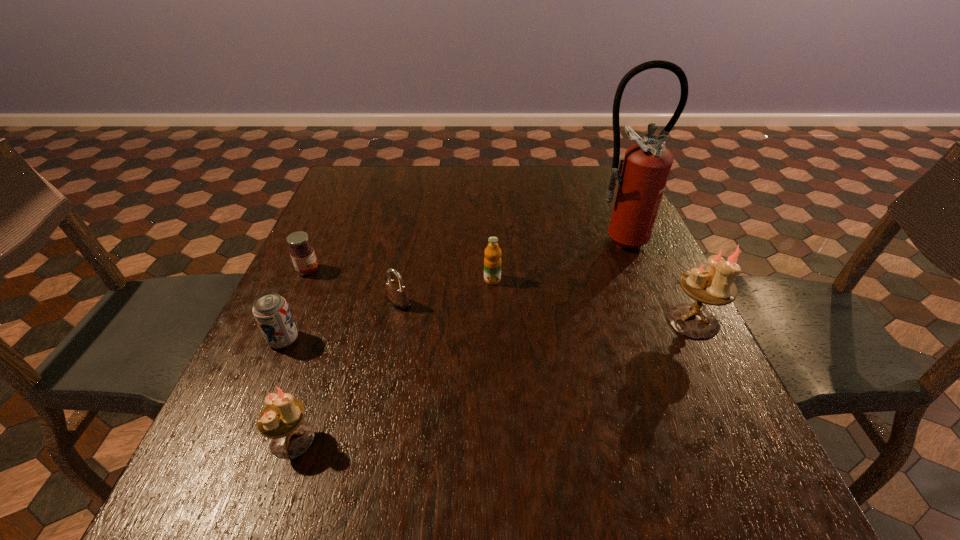
You are a GUI agent. You are given a task and a screenshot of the screen. Output one action in this format:
    pyautogui.click(x=<x>, y=<y>)
    Task: Click on the vacant area that lies between the tallest object and the jam
    Image resolution: width=960 pixels, height=540 pixels.
    Given the screenshot: What is the action you would take?
    pyautogui.click(x=462, y=255)

Find the location of a particular element. The image size is (960, 540). vacant point located between the taller candle holder and the jam is located at coordinates (500, 296).

Find the location of a particular element. This screenshot has height=540, width=960. vacant area between the shorter candle holder and the fourth object from left to right is located at coordinates (346, 372).

I want to click on free spot between the taller candle holder and the jam, so click(x=500, y=296).

The height and width of the screenshot is (540, 960). Identify the location of free spot between the jam and the nearest object. (300, 355).

At what (x,y) coordinates should I click in order to perform the action: click on free space between the nearer candle holder and the jam. Please return your answer as a coordinate pair (x, y). Looking at the image, I should click on (300, 355).

Where is `free space between the jam and the padlock`? This screenshot has height=540, width=960. free space between the jam and the padlock is located at coordinates (353, 287).

This screenshot has width=960, height=540. What are the coordinates of `vacant region between the fourth object from left to right and the beer can` in the screenshot? It's located at (341, 322).

Locate an element on the screen. The height and width of the screenshot is (540, 960). empty space that is in between the fifth object from left to right and the taller candle holder is located at coordinates (592, 300).

At what (x,y) coordinates should I click in order to perform the action: click on free space that is in between the third object from left to right and the fire extinguisher. Please return your answer as a coordinate pair (x, y). The width and height of the screenshot is (960, 540). Looking at the image, I should click on (454, 340).